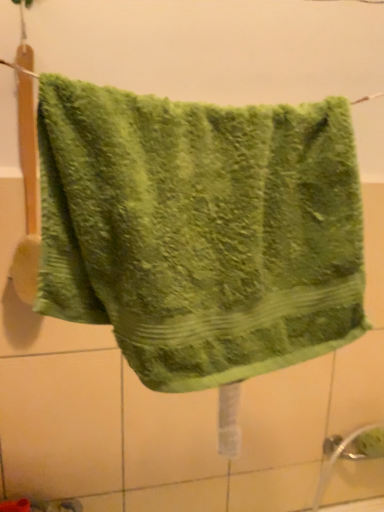
Locate an element on the screen. white matte tile at lower left is located at coordinates (61, 424).

What do you see at coordinates (61, 424) in the screenshot?
I see `white matte tile at lower left` at bounding box center [61, 424].

Describe the element at coordinates (200, 230) in the screenshot. I see `green fluffy towel at center` at that location.

You are a GUI agent. You are given a task and a screenshot of the screen. Output one action in this format:
    pyautogui.click(x=<x>, y=<y>)
    Task: Click on the green fluffy towel at center
    The image size is (384, 512).
    Given the screenshot: What is the action you would take?
    pyautogui.click(x=200, y=230)

I want to click on white matte tile at lower left, so click(x=61, y=424).

Can you confirm if green fluffy towel at center is positioned to the right of white matte tile at lower left?

Yes.

Does green fluffy towel at center come in front of white matte tile at lower left?

Yes, it is.

Is point (106, 226) positioned in front of point (15, 401)?

Yes, point (106, 226) is in front of point (15, 401).

Looking at this image, from the image's perspective, is green fluffy towel at center under white matte tile at lower left?

No, from the image's perspective, green fluffy towel at center is not beneath white matte tile at lower left.

From a real-world perspective, is green fluffy towel at center on white matte tile at lower left?

Correct, in the physical world, green fluffy towel at center is higher than white matte tile at lower left.

Between green fluffy towel at center and white matte tile at lower left, which one has larger width?

green fluffy towel at center is wider.

Is green fluffy towel at center taller or shorter than white matte tile at lower left?

In the image, green fluffy towel at center appears to be shorter than white matte tile at lower left.

Can you confirm if green fluffy towel at center is smaller than white matte tile at lower left?

Incorrect, green fluffy towel at center is not smaller in size than white matte tile at lower left.

Is green fluffy towel at center positioned beyond the bounds of white matte tile at lower left?

Yes, green fluffy towel at center is located beyond the bounds of white matte tile at lower left.

Is green fluffy towel at center touching white matte tile at lower left?

No.

Is green fluffy towel at center positioned with its back to white matte tile at lower left?

green fluffy towel at center does not have its back to white matte tile at lower left.

Measure the distance between green fluffy towel at center and white matte tile at lower left.

green fluffy towel at center is 20.91 inches away from white matte tile at lower left.

The width and height of the screenshot is (384, 512). In order to click on tile below the green fluffy towel at center (from the image's perspective) in this screenshot , I will do `click(61, 424)`.

Considering the relative positions of white matte tile at lower left and green fluffy towel at center in the image provided, is white matte tile at lower left to the left of green fluffy towel at center from the viewer's perspective?

Yes, white matte tile at lower left is to the left of green fluffy towel at center.

Relative to green fluffy towel at center, is white matte tile at lower left in front or behind?

white matte tile at lower left is behind green fluffy towel at center.

Is point (12, 372) behind point (324, 298)?

That is True.

From the image's perspective, between white matte tile at lower left and green fluffy towel at center, who is located below?

white matte tile at lower left.

Consider the image. From a real-world perspective, is white matte tile at lower left positioned over green fluffy towel at center based on gravity?

No.

Between white matte tile at lower left and green fluffy towel at center, which one has larger width?

Wider between the two is green fluffy towel at center.

From the picture: Does white matte tile at lower left have a greater height compared to green fluffy towel at center?

Correct, white matte tile at lower left is much taller as green fluffy towel at center.

Between white matte tile at lower left and green fluffy towel at center, which one has smaller size?

white matte tile at lower left.

Is white matte tile at lower left located outside green fluffy towel at center?

Yes.

Is white matte tile at lower left beside green fluffy towel at center?

No, white matte tile at lower left is not touching green fluffy towel at center.

Could you tell me if white matte tile at lower left is facing green fluffy towel at center?

No, white matte tile at lower left is not aimed at green fluffy towel at center.

Can you tell me how much white matte tile at lower left and green fluffy towel at center differ in facing direction?

They differ by 0.00463 degrees in their facing directions.

In the scene shown: How much distance is there between white matte tile at lower left and green fluffy towel at center?

They are 20.91 inches apart.

I want to click on towel in front of the white matte tile at lower left, so click(x=200, y=230).

This screenshot has height=512, width=384. I want to click on towel that appears above the white matte tile at lower left (from the image's perspective), so click(x=200, y=230).

Image resolution: width=384 pixels, height=512 pixels. Identify the location of towel in front of the white matte tile at lower left. (200, 230).